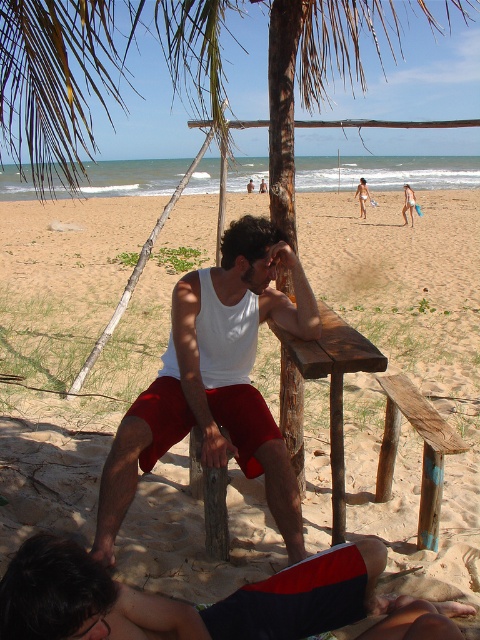
Is wooden bench at center further to camera compared to brown wooden bench at center?

Yes, it is.

The image size is (480, 640). What do you see at coordinates (407, 365) in the screenshot?
I see `wooden bench at center` at bounding box center [407, 365].

Identify the location of wooden bench at center. Image resolution: width=480 pixels, height=640 pixels. (407, 365).

Between point (115, 509) and point (368, 365), which one is positioned in front?

Point (368, 365)

Is point (266, 316) less distant than point (367, 349)?

That is False.

Where is `white matte tank top at center`? white matte tank top at center is located at coordinates (216, 381).

Between black matte shorts at lower center and brown wooden bench at center, which one has less height?

black matte shorts at lower center is shorter.

Is point (44, 577) positioned behind point (364, 352)?

No.

Image resolution: width=480 pixels, height=640 pixels. What do you see at coordinates (180, 602) in the screenshot?
I see `black matte shorts at lower center` at bounding box center [180, 602].

Where is `black matte shorts at lower center`? The width and height of the screenshot is (480, 640). black matte shorts at lower center is located at coordinates (180, 602).